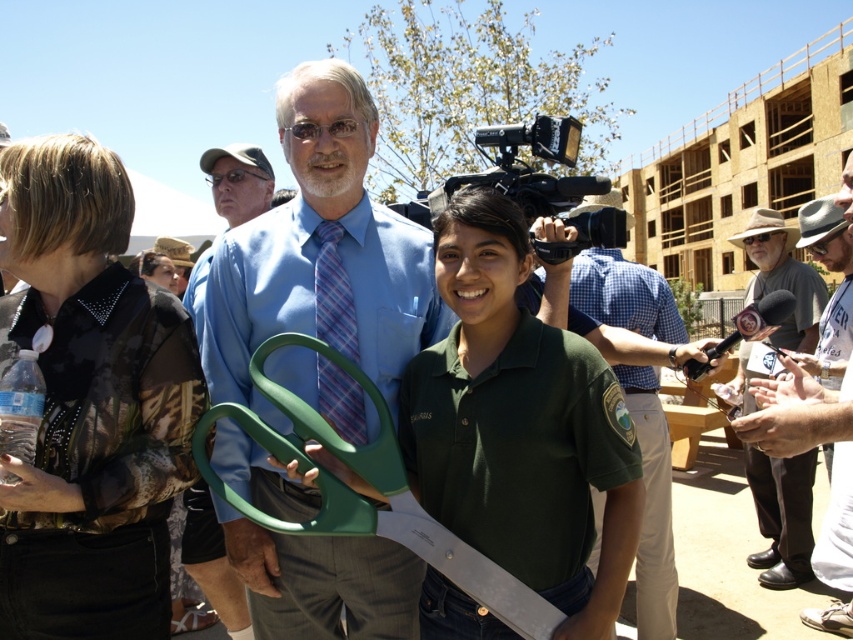
You are a photographer at the event and want to focus on both the point at (236, 301) and the point at (778, 419). Which point is closer to the camera?

Point (778, 419) is closer to the camera than point (236, 301) because the description states that point (236, 301) is further away.

You are attending an outdoor event and see two items in the foreground. The camouflage shirt at left is worn by a person, and the gray felt hat at right is worn by another. Which item is located more to the left?

The camouflage shirt at left is more to the left than the gray felt hat at right.